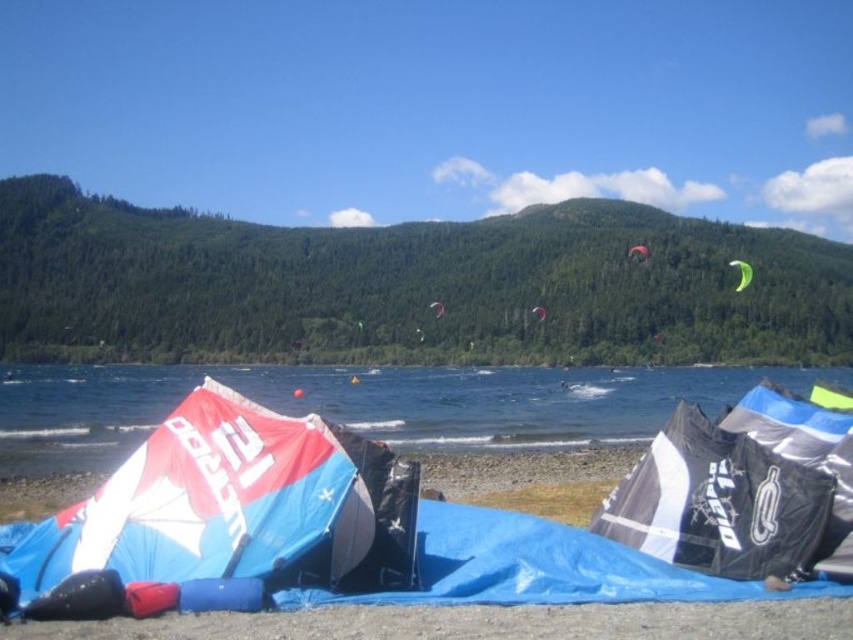
In the scene shown: You are standing at the center of the lakeside beach and see the point at coordinates (x=741, y=273). What object is located at this point?

The point at coordinates (x=741, y=273) corresponds to the green matte parachute at upper right.

You are organizing a kite display at the lakeside beach. You have two red kites available for display. The red fabric kite at center and the red kite at center. Which one should you choose if you want to display a larger kite?

The red fabric kite at center has a larger size compared to the red kite at center, so you should choose the red fabric kite at center for the display.

You are a photographer planning to capture a wide shot of the lake scene. You want to include both the green matte parachute at upper right and the red kite at center in your frame. Given their sizes, which object will appear bigger in your photo?

The green matte parachute at upper right will appear bigger in the photo because it is larger in size than the red kite at center.